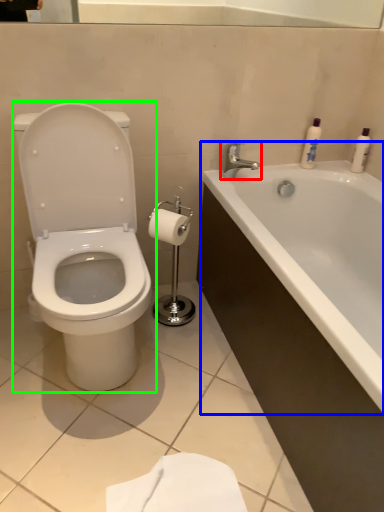
Question: Based on their relative distances, which object is farther from tap (highlighted by a red box)? Choose from bathtub (highlighted by a blue box) and toilet (highlighted by a green box).

Choices:
 (A) bathtub
 (B) toilet

Answer: (B)